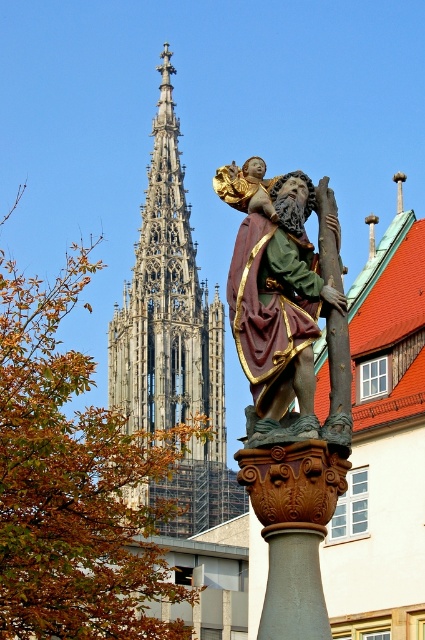
Question: Can you confirm if stone gothic spire at upper left is smaller than polychrome wood statue of saint christopher at center?

Choices:
 (A) no
 (B) yes

Answer: (A)

Question: Which object is farther from the camera taking this photo?

Choices:
 (A) polychrome wood statue of saint christopher at center
 (B) smooth gray stone pillar at center
 (C) stone gothic spire at upper left

Answer: (C)

Question: Is polychrome wood statue of saint christopher at center wider than smooth gray stone pillar at center?

Choices:
 (A) no
 (B) yes

Answer: (B)

Question: Which point is farther from the camera taking this photo?

Choices:
 (A) (237, 504)
 (B) (257, 634)

Answer: (A)

Question: Is polychrome wood statue of saint christopher at center smaller than smooth gray stone pillar at center?

Choices:
 (A) no
 (B) yes

Answer: (A)

Question: Which object appears farthest from the camera in this image?

Choices:
 (A) smooth gray stone pillar at center
 (B) stone gothic spire at upper left

Answer: (B)